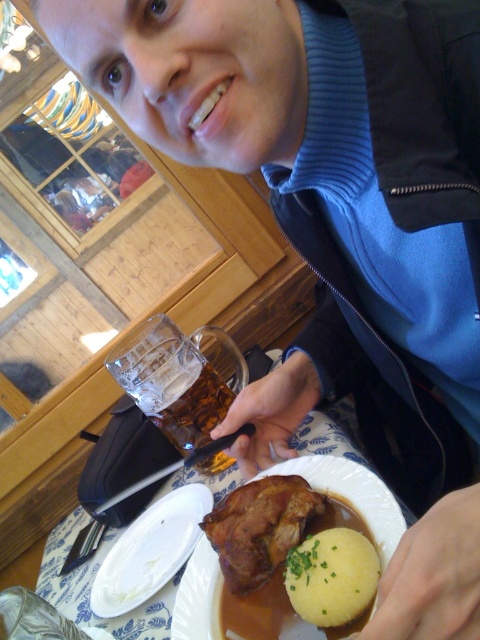
Question: Can you confirm if translucent glass mug at lower center is positioned above brown matte meat at center?

Choices:
 (A) no
 (B) yes

Answer: (B)

Question: Based on their relative distances, which object is nearer to the white matte plate at lower left?

Choices:
 (A) brown matte meat at center
 (B) translucent glass mug at lower center
 (C) matte brown plate at center

Answer: (C)

Question: Among these points, which one is farthest from the camera?

Choices:
 (A) (184, 424)
 (B) (233, 499)
 (C) (144, 560)

Answer: (A)

Question: Can you confirm if matte brown plate at center is thinner than white matte plate at lower left?

Choices:
 (A) yes
 (B) no

Answer: (B)

Question: Which point is closer to the camera taking this photo?

Choices:
 (A) (132, 342)
 (B) (265, 570)

Answer: (B)

Question: Observing the image, what is the correct spatial positioning of matte brown plate at center in reference to translucent glass mug at lower center?

Choices:
 (A) below
 (B) above

Answer: (A)